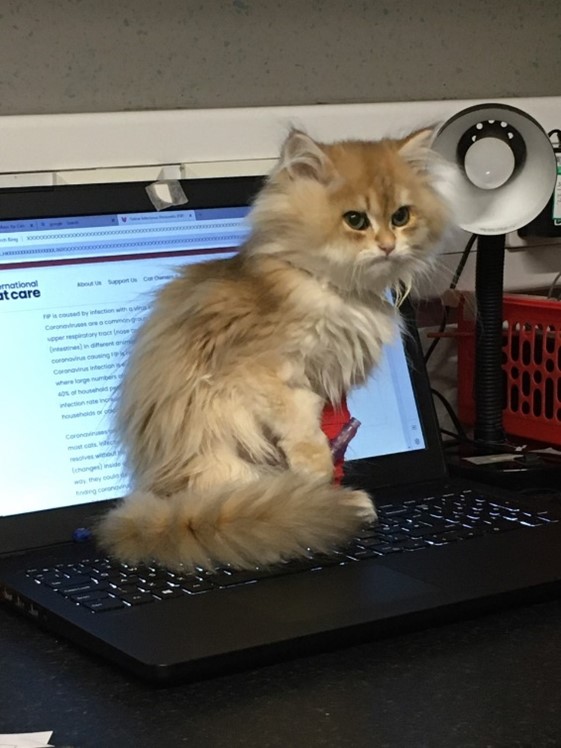
Locate an element on the screen. The image size is (561, 748). gray wall with black speckles is located at coordinates (x=240, y=55).